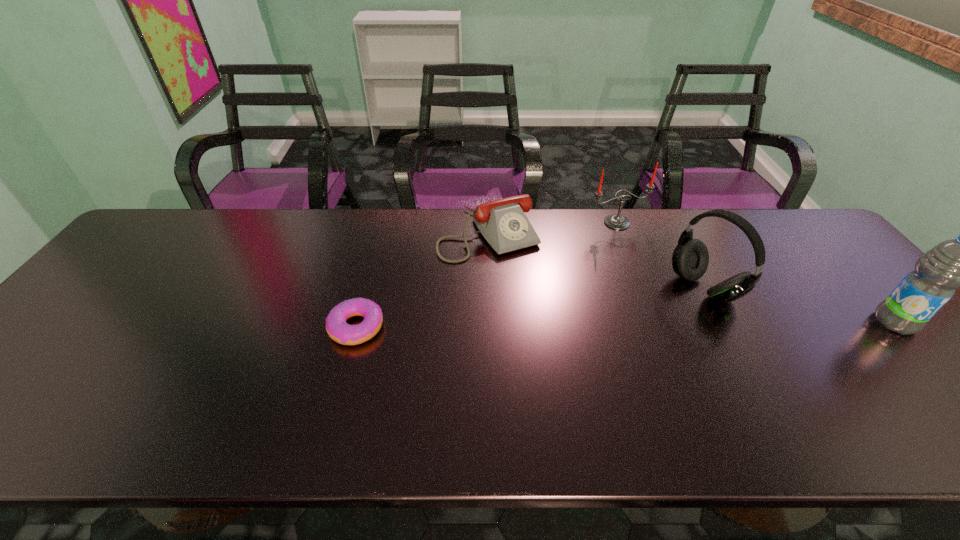
Identify the location of object situated at the right edge. (958, 263).

Locate an element on the screen. vacant space at the far edge of the desktop is located at coordinates (455, 246).

Image resolution: width=960 pixels, height=540 pixels. Identify the location of vacant space at the near edge. (525, 375).

The height and width of the screenshot is (540, 960). I want to click on vacant area at the left edge, so click(x=60, y=332).

The width and height of the screenshot is (960, 540). I want to click on free location at the right edge of the desktop, so click(903, 340).

In the image, there is a desktop. At what (x,y) coordinates should I click in order to perform the action: click on vacant space at the far right corner. Please return your answer as a coordinate pair (x, y). The height and width of the screenshot is (540, 960). Looking at the image, I should click on (804, 254).

The width and height of the screenshot is (960, 540). Identify the location of vacant area that lies between the shortest object and the rightmost object. pyautogui.click(x=625, y=325).

Find the location of `free spot between the fourth object from right to left and the candle`. free spot between the fourth object from right to left and the candle is located at coordinates (552, 228).

Locate an element on the screen. The height and width of the screenshot is (540, 960). free area in between the headset and the fourth object from right to left is located at coordinates (596, 261).

Find the location of `unoccupied area between the rightmost object and the shortest object`. unoccupied area between the rightmost object and the shortest object is located at coordinates (625, 325).